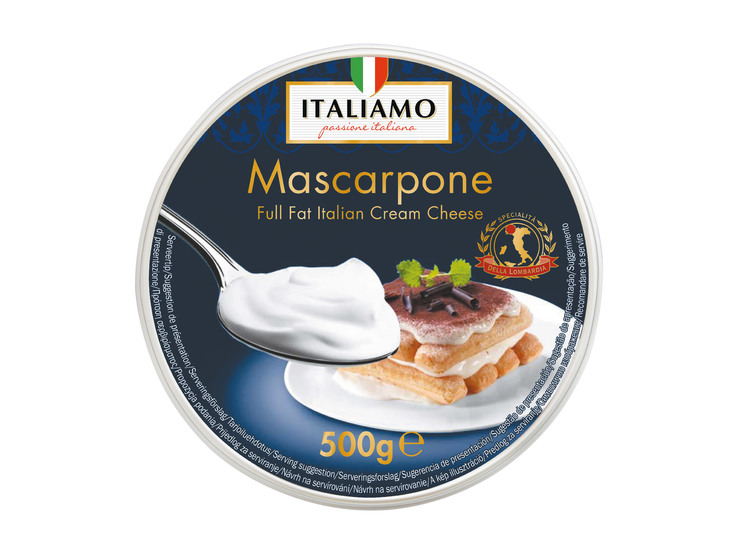
Locate an element on the screen. thin handle of metal spoon on left side of image is located at coordinates (165, 209).